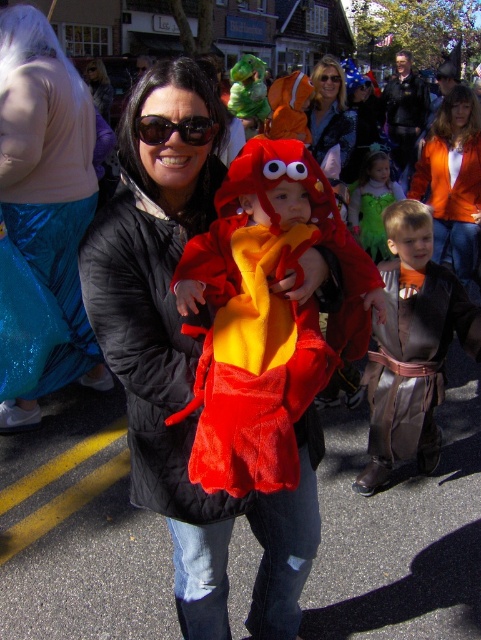
You are a photographer at the event and want to capture a photo where the brown leather armor at lower right is visible above the black plastic sunglasses at center. Is this possible given their current positions?

The brown leather armor at lower right is below the black plastic sunglasses at center, so it would not be possible to capture a photo where the brown leather armor at lower right is visible above the black plastic sunglasses at center in their current positions.